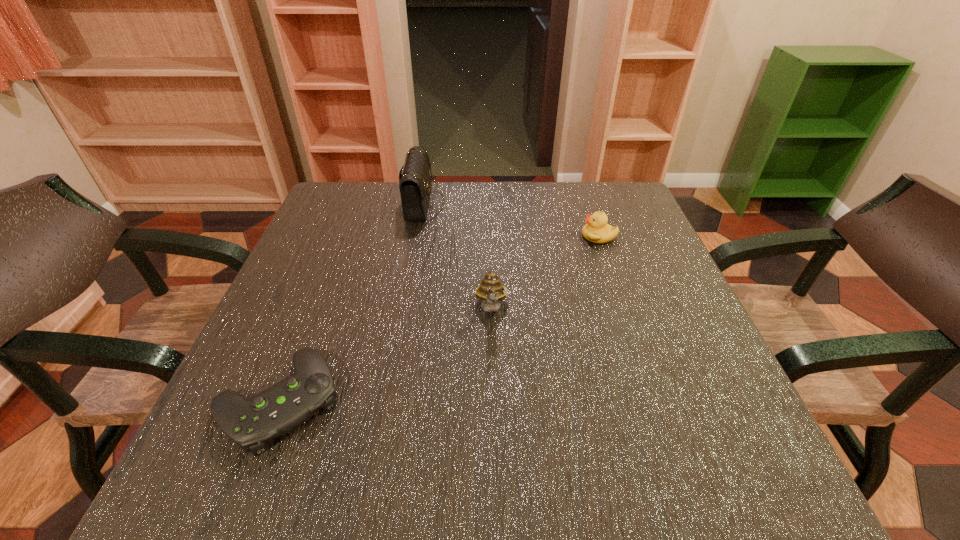
At what (x,y) coordinates should I click in order to perform the action: click on object situated at the far right corner. Please return your answer as a coordinate pair (x, y). Looking at the image, I should click on (596, 230).

I want to click on free location at the far edge of the desktop, so (x=521, y=201).

What are the coordinates of `free space at the near edge` in the screenshot? It's located at (309, 463).

Where is `vacant space at the left edge`? The height and width of the screenshot is (540, 960). vacant space at the left edge is located at coordinates (277, 323).

Where is `vacant space at the right edge of the desktop`? The image size is (960, 540). vacant space at the right edge of the desktop is located at coordinates (604, 264).

Locate an element on the screen. Image resolution: width=960 pixels, height=540 pixels. vacant space at the far left corner of the desktop is located at coordinates (380, 193).

Find the location of `vacant space at the far right corner of the desktop`. vacant space at the far right corner of the desktop is located at coordinates (599, 194).

At what (x,y) coordinates should I click in order to perform the action: click on vacant area at the near right corner. Please return your answer as a coordinate pair (x, y). The height and width of the screenshot is (540, 960). Looking at the image, I should click on (761, 497).

The image size is (960, 540). In order to click on free space between the nearest object and the second object from left to right in this screenshot , I will do `click(351, 302)`.

Identify the location of vacant point located between the shortest object and the second farthest object. The width and height of the screenshot is (960, 540). (439, 319).